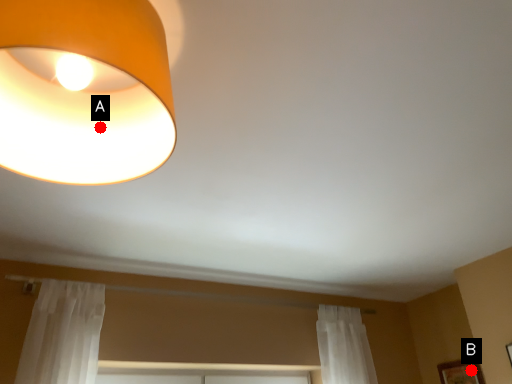
Question: Two points are circled on the image, labeled by A and B beside each circle. Which point appears farthest from the camera in this image?

Choices:
 (A) A is further
 (B) B is further

Answer: (B)